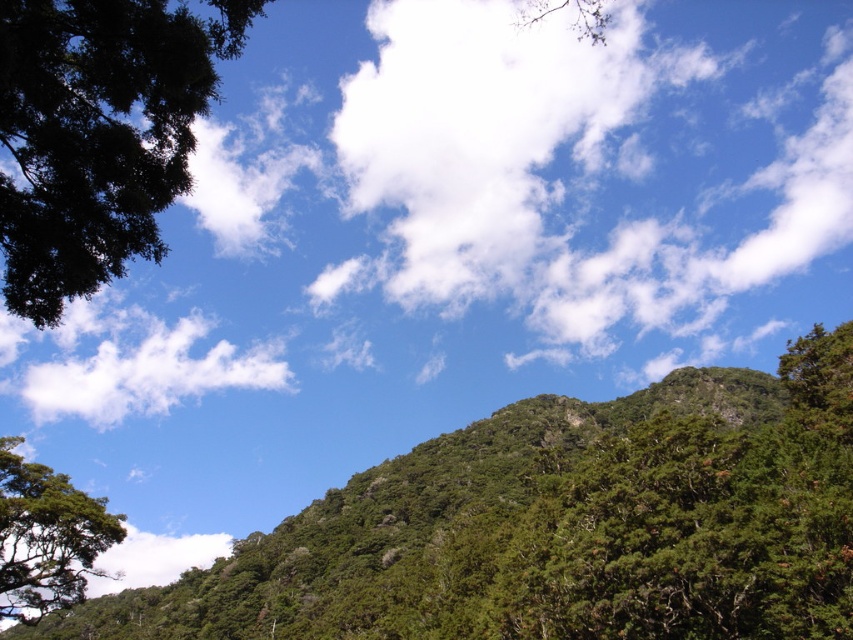
Between point (53, 624) and point (64, 604), which one is positioned in front?

Positioned in front is point (64, 604).

Is point (343, 547) in front of point (48, 557)?

That is False.

Is point (228, 576) less distant than point (47, 522)?

No, (228, 576) is behind (47, 522).

I want to click on green leafy hillside at center, so click(x=398, y=506).

Is point (32, 83) positioned after point (59, 488)?

No, (32, 83) is closer to viewer.

Who is higher up, green leafy tree at upper left or green leafy tree at left?

green leafy tree at upper left is above.

Is point (56, 250) positioned behind point (4, 540)?

That is False.

Image resolution: width=853 pixels, height=640 pixels. Identify the location of green leafy tree at upper left. (97, 134).

Can you confirm if green leafy tree at left is taller than white fluffy cloud at lower left?

No.

Can you confirm if green leafy tree at left is shorter than white fluffy cloud at lower left?

Correct, green leafy tree at left is not as tall as white fluffy cloud at lower left.

Between point (57, 474) and point (221, 541), which one is positioned in front?

Positioned in front is point (57, 474).

Where is `green leafy tree at left`? green leafy tree at left is located at coordinates (45, 538).